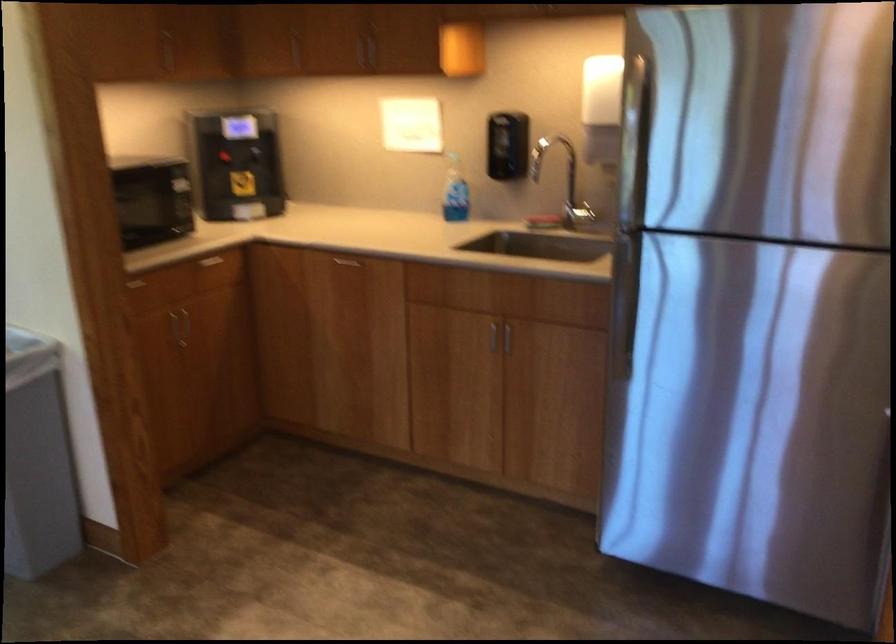
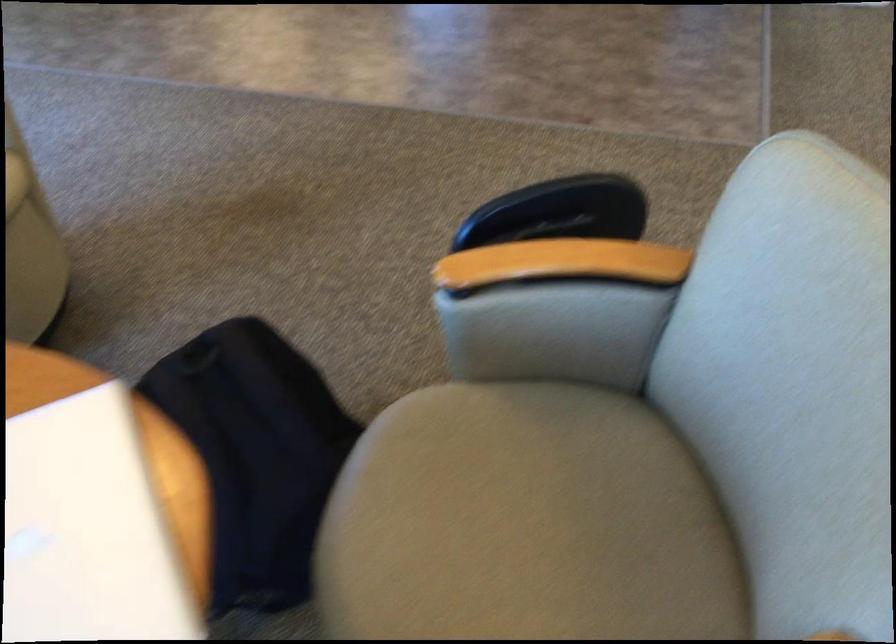
Question: In a continuous first-person perspective shot, in which direction is the camera moving?

Choices:
 (A) Left
 (B) Right
 (C) Forward
 (D) Backward

Answer: (D)